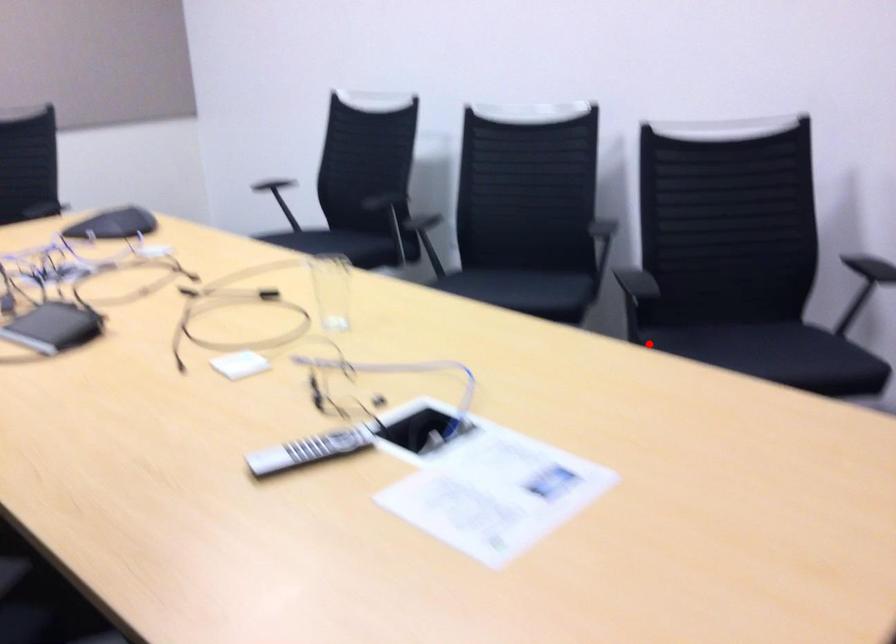
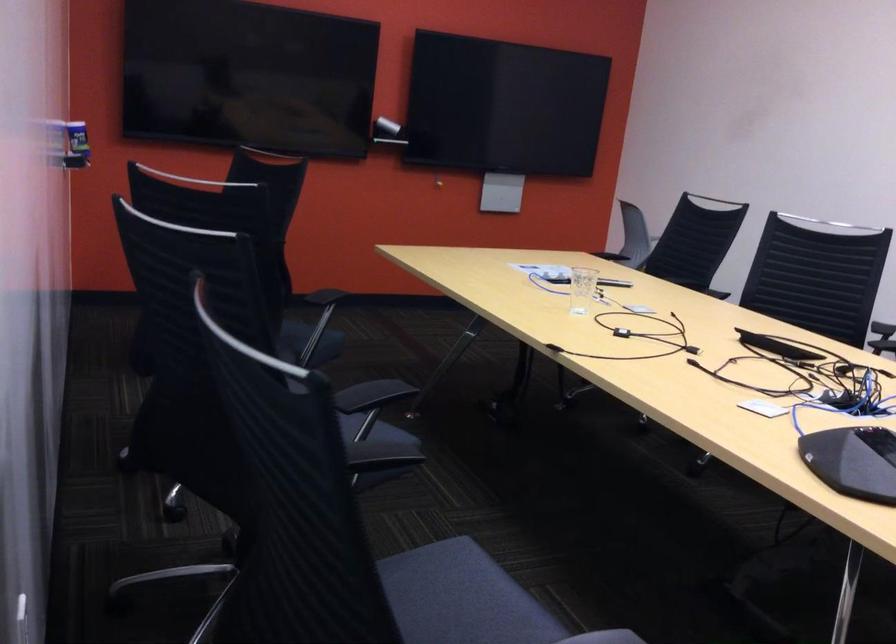
Find the pixel in the second image that matches the highlighted location in the first image.

(308, 342)